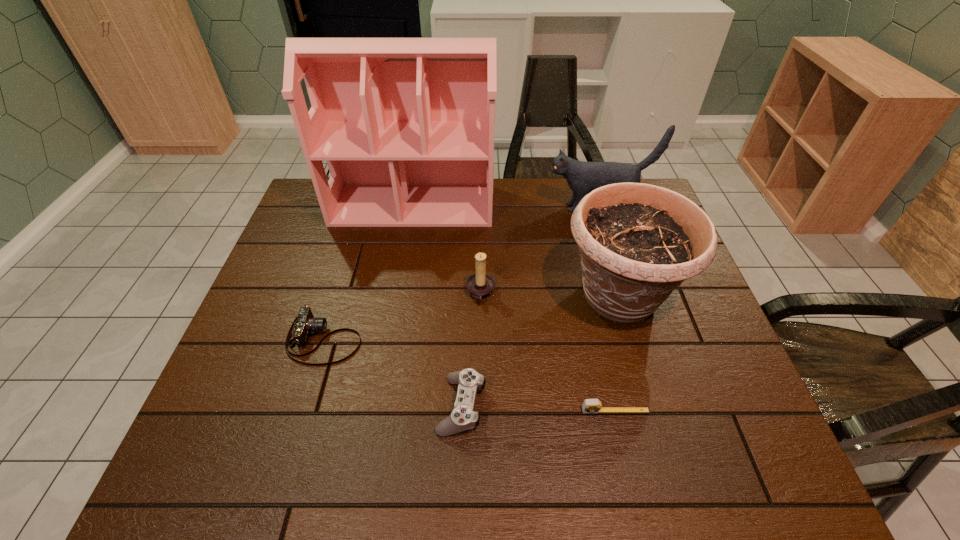
You are a GUI agent. You are given a task and a screenshot of the screen. Output one action in this format:
    pyautogui.click(x=<x>, y=<y>)
    Task: Click on the tallest object
    This screenshot has height=540, width=960.
    Given the screenshot: What is the action you would take?
    pyautogui.click(x=406, y=125)

The image size is (960, 540). What are the coordinates of `cat` in the screenshot? It's located at (582, 177).

At what (x,y) coordinates should I click in order to perform the action: click on flowerpot. Please return your answer as a coordinate pair (x, y). Image resolution: width=960 pixels, height=540 pixels. Looking at the image, I should click on (638, 242).

The height and width of the screenshot is (540, 960). In order to click on candle holder in this screenshot , I will do `click(480, 285)`.

The width and height of the screenshot is (960, 540). I want to click on camera, so click(306, 324).

In order to click on control in this screenshot , I will do (463, 417).

Locate an element on the screen. The image size is (960, 540). the shortest object is located at coordinates (589, 405).

Find the location of a particular element. The width and height of the screenshot is (960, 540). vacant position located 0.130m on the front-facing side of the dollhouse is located at coordinates (404, 258).

The width and height of the screenshot is (960, 540). Find the location of `free space located at the face of the cat`. free space located at the face of the cat is located at coordinates (514, 207).

The image size is (960, 540). In order to click on vacant space situated at the face of the cat in this screenshot , I will do `click(480, 207)`.